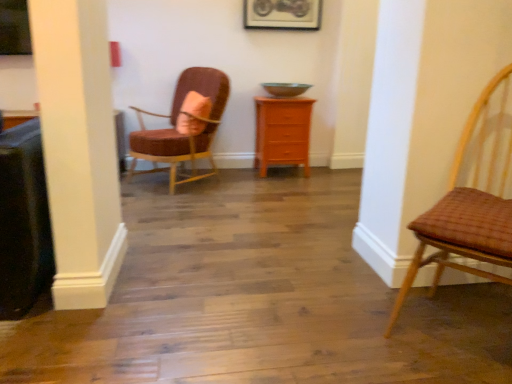
Question: Does orange wood chest of drawers at center appear on the right side of woven brown chair at right, placed as the first chair when sorted from right to left?

Choices:
 (A) no
 (B) yes

Answer: (A)

Question: From the image's perspective, is orange wood chest of drawers at center below woven brown chair at right, the 2th chair when ordered from left to right?

Choices:
 (A) yes
 (B) no

Answer: (B)

Question: From the image's perspective, is orange wood chest of drawers at center above woven brown chair at right, the first chair when ordered from front to back?

Choices:
 (A) no
 (B) yes

Answer: (B)

Question: Considering the relative positions of orange wood chest of drawers at center and woven brown chair at right, the first chair when ordered from front to back, in the image provided, is orange wood chest of drawers at center in front of woven brown chair at right, the first chair when ordered from front to back,?

Choices:
 (A) yes
 (B) no

Answer: (B)

Question: Is orange wood chest of drawers at center smaller than woven brown chair at right, placed as the first chair when sorted from right to left?

Choices:
 (A) yes
 (B) no

Answer: (A)

Question: In the image, is orange wood chest of drawers at center positioned in front of or behind velvet pink chair at upper left, the second chair when ordered from front to back?

Choices:
 (A) front
 (B) behind

Answer: (B)

Question: From a real-world perspective, is orange wood chest of drawers at center physically located above or below velvet pink chair at upper left, the first chair from the left?

Choices:
 (A) below
 (B) above

Answer: (A)

Question: Do you think orange wood chest of drawers at center is within velvet pink chair at upper left, which is the second chair from right to left, or outside of it?

Choices:
 (A) inside
 (B) outside

Answer: (B)

Question: Based on their sizes in the image, would you say orange wood chest of drawers at center is bigger or smaller than velvet pink chair at upper left, which is the second chair from right to left?

Choices:
 (A) small
 (B) big

Answer: (A)

Question: From the image's perspective, is woven brown chair at right, the first chair when ordered from front to back, above or below orange wood chest of drawers at center?

Choices:
 (A) above
 (B) below

Answer: (B)

Question: Is point (496, 233) positioned closer to the camera than point (293, 147)?

Choices:
 (A) closer
 (B) farther

Answer: (A)

Question: Based on their sizes in the image, would you say woven brown chair at right, the first chair when ordered from front to back, is bigger or smaller than orange wood chest of drawers at center?

Choices:
 (A) small
 (B) big

Answer: (B)

Question: Do you think woven brown chair at right, the second chair viewed from the back, is within orange wood chest of drawers at center, or outside of it?

Choices:
 (A) outside
 (B) inside

Answer: (A)

Question: Considering their positions, is orange wood chest of drawers at center located in front of or behind metallic silver picture frame at upper center?

Choices:
 (A) behind
 (B) front

Answer: (B)

Question: From the image's perspective, is orange wood chest of drawers at center located above or below metallic silver picture frame at upper center?

Choices:
 (A) above
 (B) below

Answer: (B)